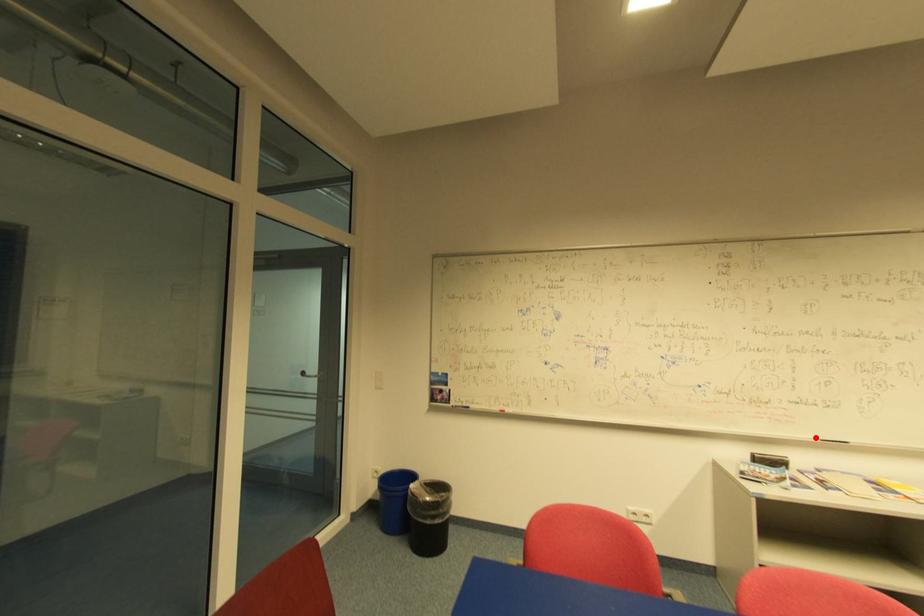
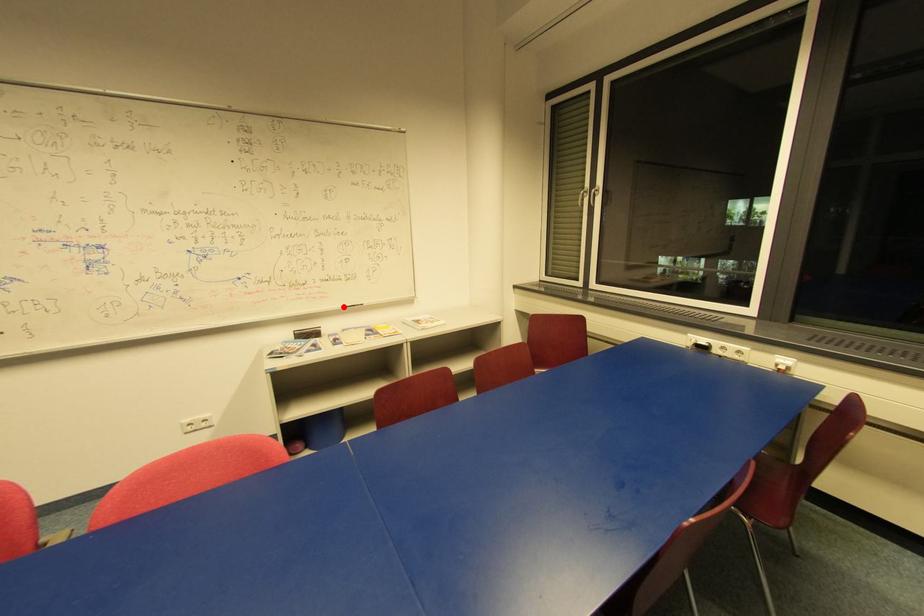
I am providing you with two images of the same scene from different viewpoints. A red point is marked on the first image and another point is marked on the second image. Do the highlighted points in image1 and image2 indicate the same real-world spot?

Yes